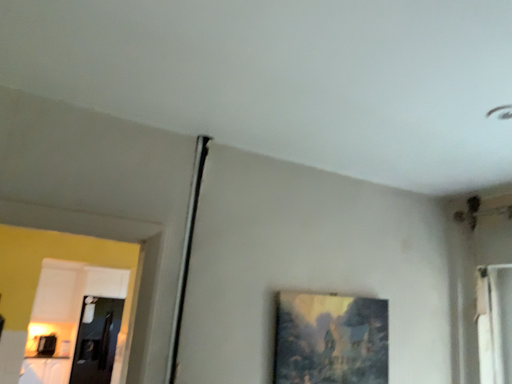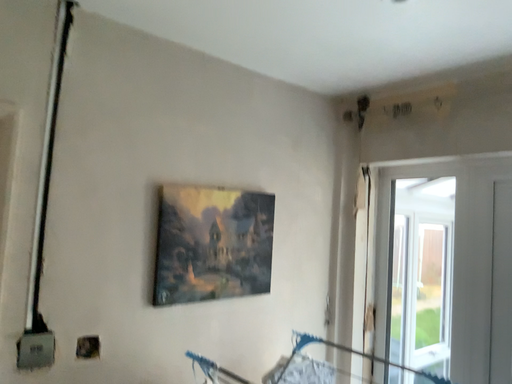
Question: Which way did the camera rotate in the video?

Choices:
 (A) rotated left
 (B) rotated right

Answer: (B)